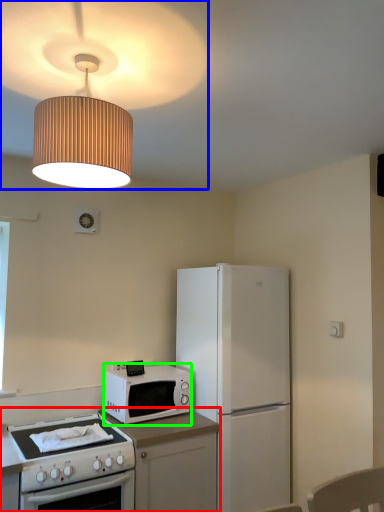
Question: Which object is the closest to the countertop (highlighted by a red box)? Choose among these: lamp (highlighted by a blue box) or microwave oven (highlighted by a green box).

Choices:
 (A) lamp
 (B) microwave oven

Answer: (B)